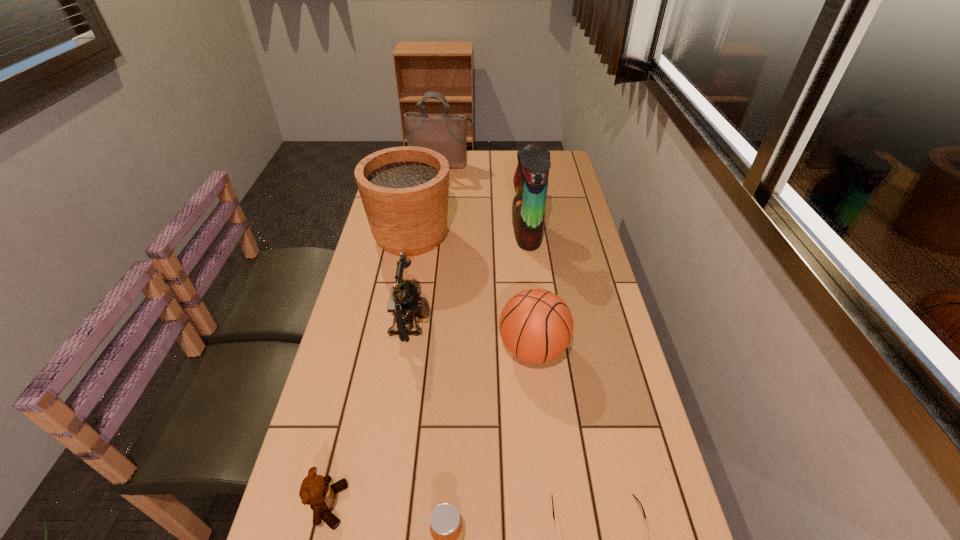
At what (x,y) coordinates should I click in order to perform the action: click on blank space located on the back of the flowerpot. Please return your answer as a coordinate pair (x, y). Image resolution: width=960 pixels, height=540 pixels. Looking at the image, I should click on (425, 160).

At what (x,y) coordinates should I click in order to perform the action: click on vacant space located 0.380m on the rotary dial of the telephone. Please return your answer as a coordinate pair (x, y). Looking at the image, I should click on (567, 322).

At what (x,y) coordinates should I click in order to perform the action: click on free space located 0.050m on the front of the basketball. Please return your answer as a coordinate pair (x, y). Looking at the image, I should click on (539, 396).

This screenshot has width=960, height=540. Find the location of `vacant space located 0.230m on the front-facing side of the teddy bear`. vacant space located 0.230m on the front-facing side of the teddy bear is located at coordinates (462, 505).

This screenshot has width=960, height=540. In order to click on object present at the far edge in this screenshot , I will do `click(445, 134)`.

In order to click on shoulder bag present at the left edge in this screenshot , I will do `click(445, 134)`.

Identify the location of flowerpot present at the left edge. This screenshot has height=540, width=960. (404, 190).

Locate an element on the screen. This screenshot has width=960, height=540. telephone positioned at the left edge is located at coordinates (405, 303).

Where is `teddy bear located in the left edge section of the desktop`? teddy bear located in the left edge section of the desktop is located at coordinates (315, 491).

Locate an element on the screen. object situated at the right edge is located at coordinates (536, 325).